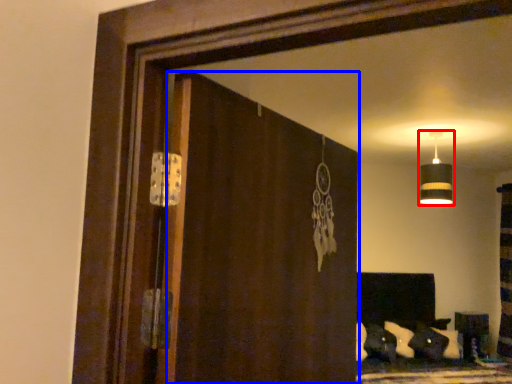
Question: Which point is closer to the camera, lamp (highlighted by a red box) or screen door (highlighted by a blue box)?

Choices:
 (A) lamp
 (B) screen door

Answer: (B)